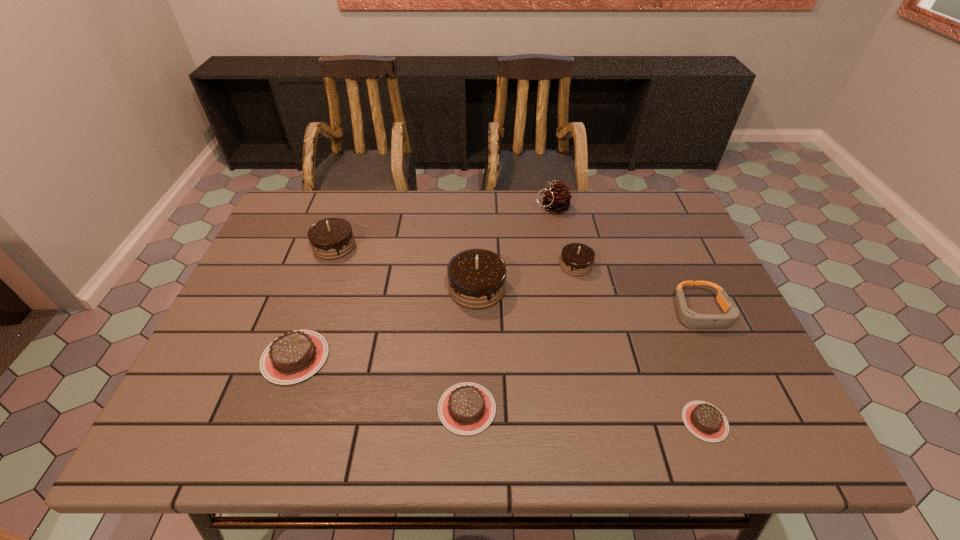
Identify the location of object positioned at the near right corner. (704, 420).

This screenshot has height=540, width=960. Identify the location of free space at the far edge. (367, 210).

Identify the location of free space at the near edge of the desktop. This screenshot has width=960, height=540. (317, 417).

You are a GUI agent. You are given a task and a screenshot of the screen. Output one action in this format:
    pyautogui.click(x=<x>, y=<y>)
    Task: Click on the blank area at the left edge
    This screenshot has height=540, width=960.
    Given the screenshot: What is the action you would take?
    pyautogui.click(x=249, y=273)

The image size is (960, 540). In the image, there is a desktop. Find the location of `free space at the far right corner`. free space at the far right corner is located at coordinates (688, 233).

Image resolution: width=960 pixels, height=540 pixels. I want to click on free space that is in between the goggles and the second tallest chocolate cake, so click(517, 279).

What are the coordinates of `unoccupied position between the rightmost chocolate cake and the second biggest brown chocolate cake` in the screenshot? It's located at (586, 415).

Identify the location of unoccupied position between the leftmost chocolate chocolate cake and the goggles. (517, 279).

Image resolution: width=960 pixels, height=540 pixels. I want to click on blank region between the fifth tallest object and the rightmost brown chocolate cake, so click(703, 367).

The height and width of the screenshot is (540, 960). I want to click on vacant space in between the fifth shortest chocolate cake and the biggest chocolate chocolate cake, so click(406, 267).